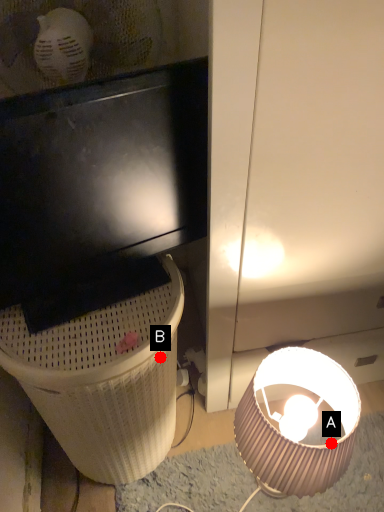
Question: Two points are circled on the image, labeled by A and B beside each circle. Which point appears closest to the camera in this image?

Choices:
 (A) A is closer
 (B) B is closer

Answer: (A)